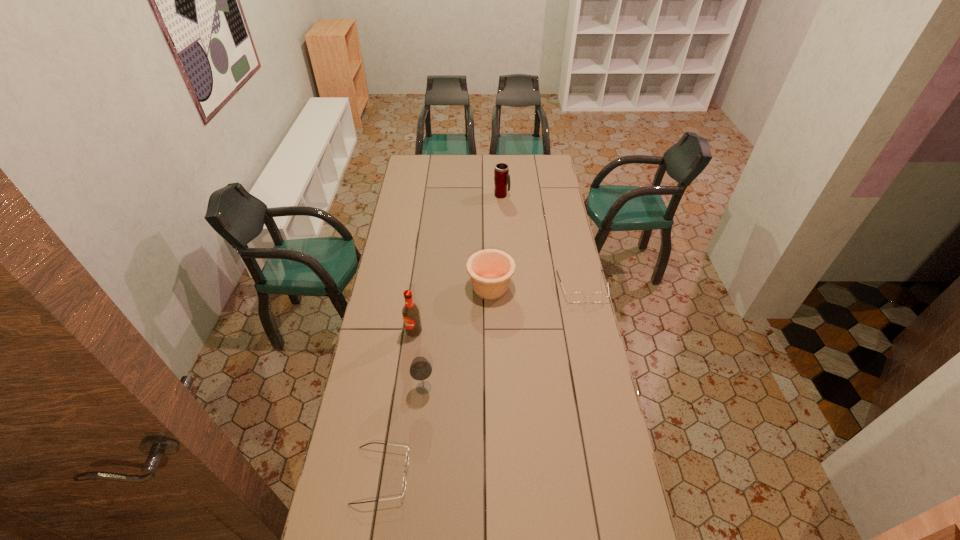
Locate an element on the screen. The height and width of the screenshot is (540, 960). vacant region at the left edge of the desktop is located at coordinates (395, 240).

In order to click on vacant area at the right edge of the desktop in this screenshot , I will do `click(564, 349)`.

Image resolution: width=960 pixels, height=540 pixels. Identify the location of vacant space at the far right corner. [x=532, y=157].

Locate an element on the screen. free spot between the taller spectacles and the pottery is located at coordinates [537, 287].

Where is `unoccupied position between the wineglass and the pottery`? The height and width of the screenshot is (540, 960). unoccupied position between the wineglass and the pottery is located at coordinates (457, 338).

The height and width of the screenshot is (540, 960). Identify the location of vacant space that's between the fifth farthest object and the rightmost object. (503, 337).

Where is `free space that is in between the beer bottle and the pottery`? This screenshot has width=960, height=540. free space that is in between the beer bottle and the pottery is located at coordinates (452, 309).

At what (x,y) coordinates should I click in order to perform the action: click on vacant space that's between the thermos bottle and the rightmost object. Please return your answer as a coordinate pair (x, y). This screenshot has height=540, width=960. Looking at the image, I should click on (542, 241).

Identify the location of free space between the third nearest object and the second shortest object. (498, 309).

Where is `free area in between the tallest object and the pottery`? This screenshot has width=960, height=540. free area in between the tallest object and the pottery is located at coordinates (452, 309).